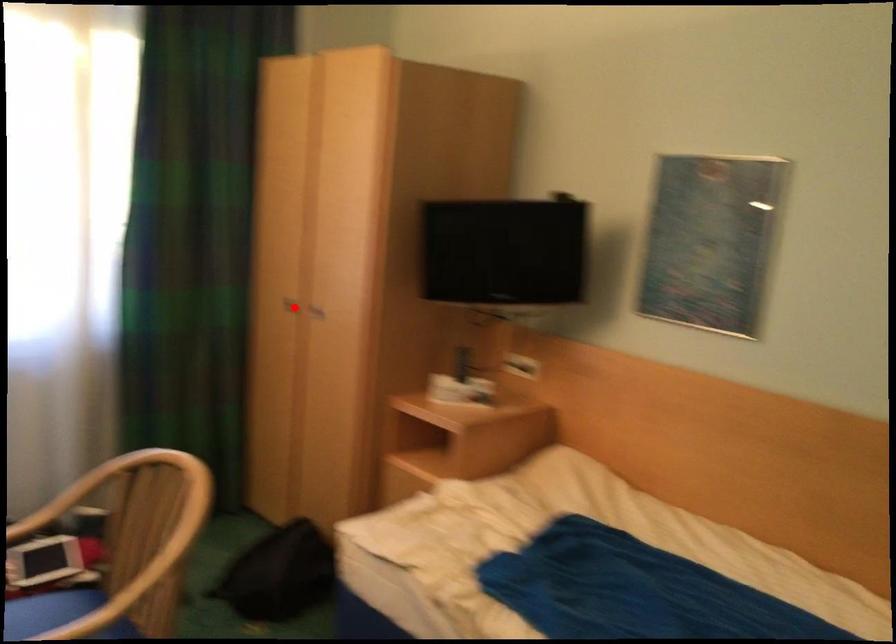
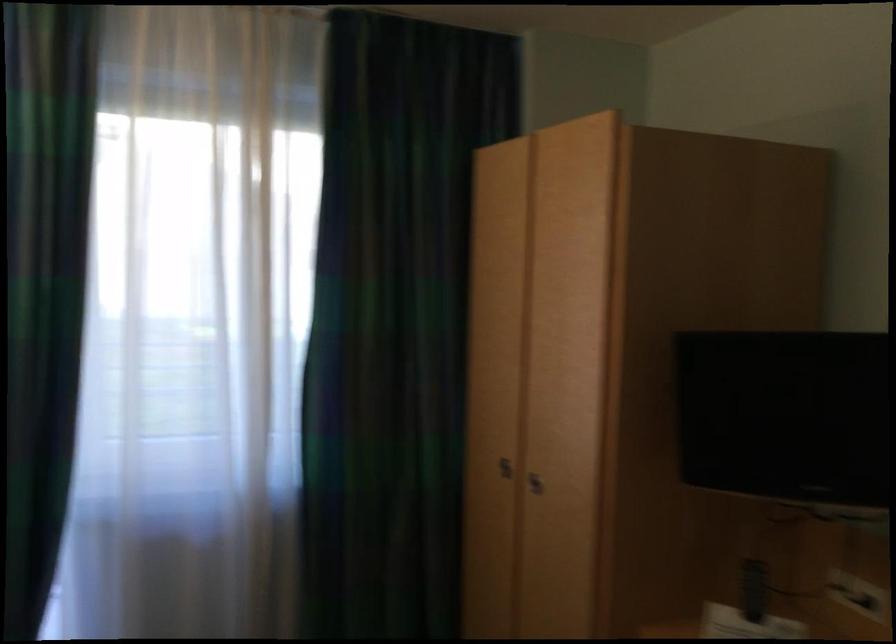
Locate, in the second image, the point that corresponds to the highlighted location in the first image.

(504, 468)